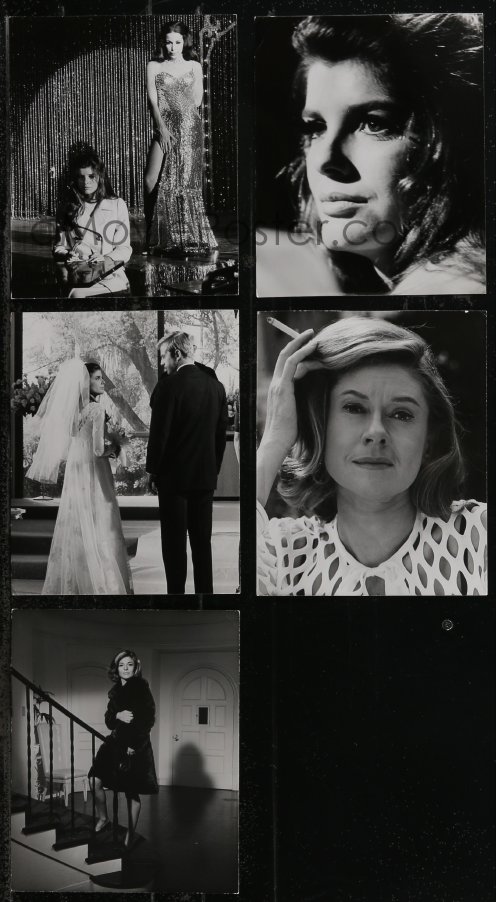
What are the coordinates of `door` in the screenshot? It's located at (219, 733).